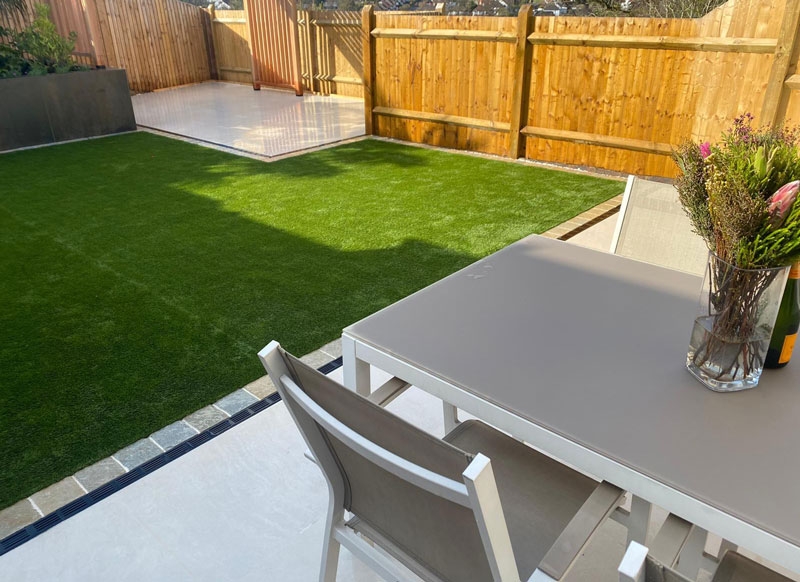
This screenshot has width=800, height=582. I want to click on vase, so (718, 303).